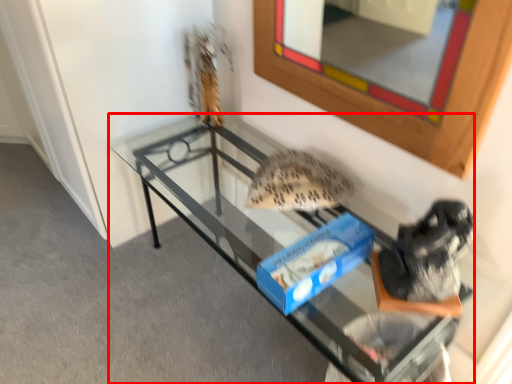
Question: Where is furniture (annotated by the red box) located in relation to mirror in the image?

Choices:
 (A) right
 (B) left

Answer: (B)